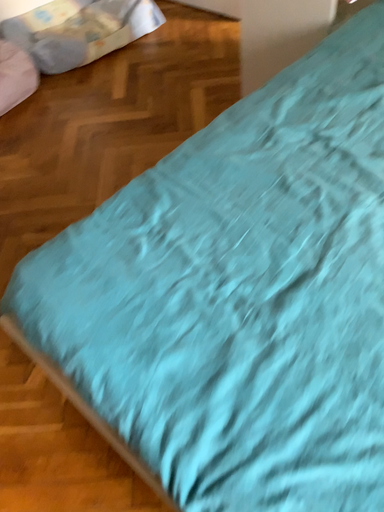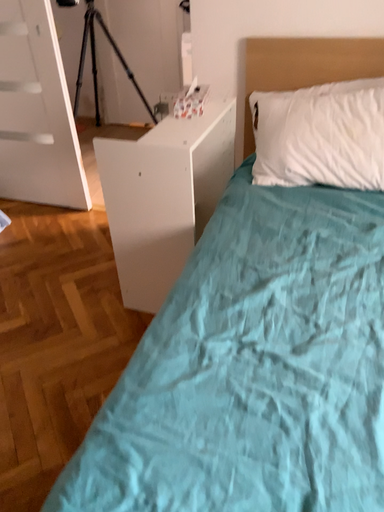
Question: Which way did the camera rotate in the video?

Choices:
 (A) rotated left
 (B) rotated right

Answer: (B)